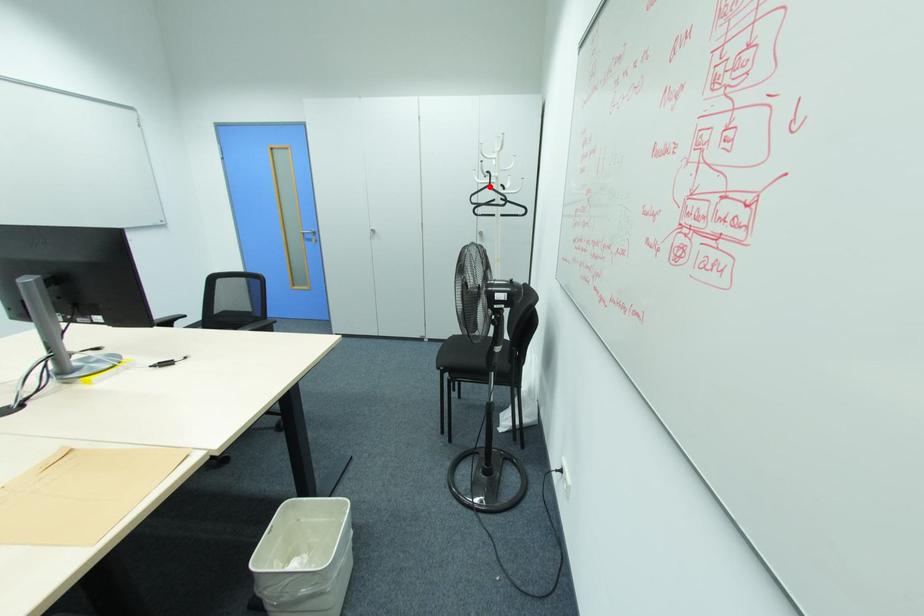
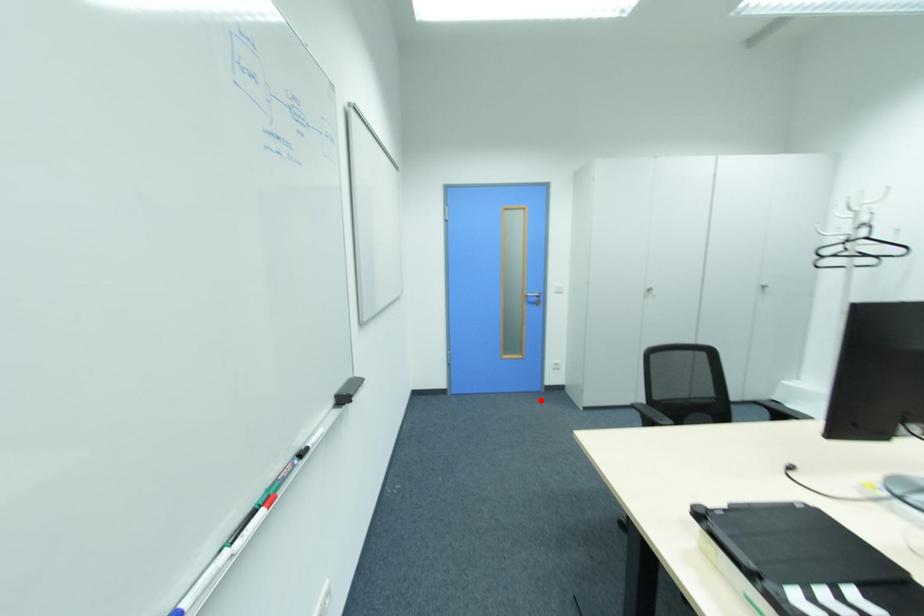
I am providing you with two images of the same scene from different viewpoints. A red point is marked on the first image and another point is marked on the second image. Do the highlighted points in image1 and image2 indicate the same real-world spot?

No